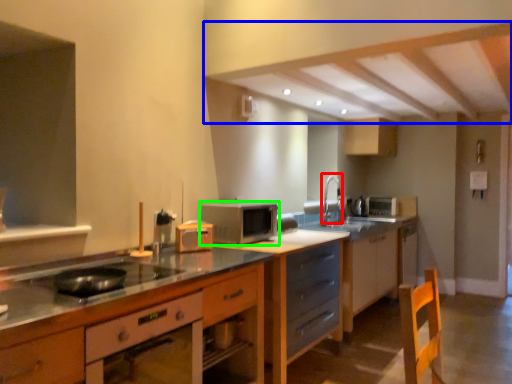
Question: Based on their relative distances, which object is nearer to faucet (highlighted by a red box)? Choose from exhaust hood (highlighted by a blue box) and microwave oven (highlighted by a green box).

Choices:
 (A) exhaust hood
 (B) microwave oven

Answer: (B)